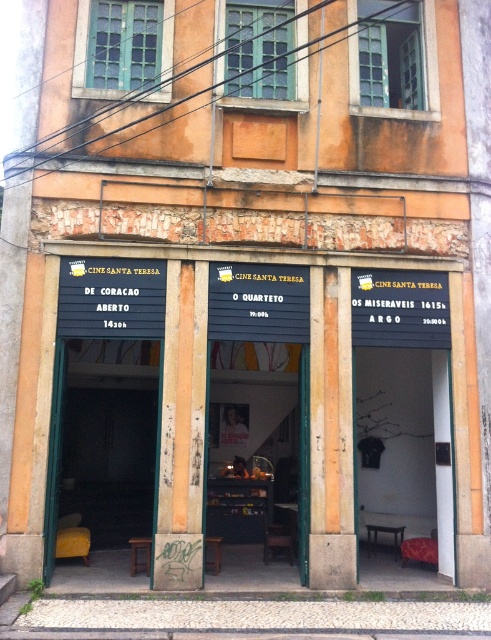
Question: Is black painted wood signboard at center in front of yellowish wood pillar at center?

Choices:
 (A) yes
 (B) no

Answer: (B)

Question: Considering the real-world distances, which object is closest to the yellow fabric chair at left?

Choices:
 (A) yellow painted concrete pillar at center
 (B) wooden chair at center
 (C) yellowish wood pillar at center
 (D) black painted wood signboard at center

Answer: (A)

Question: Which object is the closest to the yellow painted concrete pillar at center?

Choices:
 (A) wooden counter at center
 (B) black painted wood signboard at center
 (C) wooden chair at center
 (D) yellow fabric chair at left

Answer: (B)

Question: Is yellow fabric chair at left to the right of yellowish wood pillar at center from the viewer's perspective?

Choices:
 (A) yes
 (B) no

Answer: (B)

Question: Considering the relative positions of yellow fabric chair at left and wooden chair at center in the image provided, where is yellow fabric chair at left located with respect to wooden chair at center?

Choices:
 (A) left
 (B) right

Answer: (A)

Question: Which point is farther to the camera?

Choices:
 (A) yellow fabric chair at left
 (B) yellowish wood pillar at center
 (C) wooden chair at center

Answer: (A)